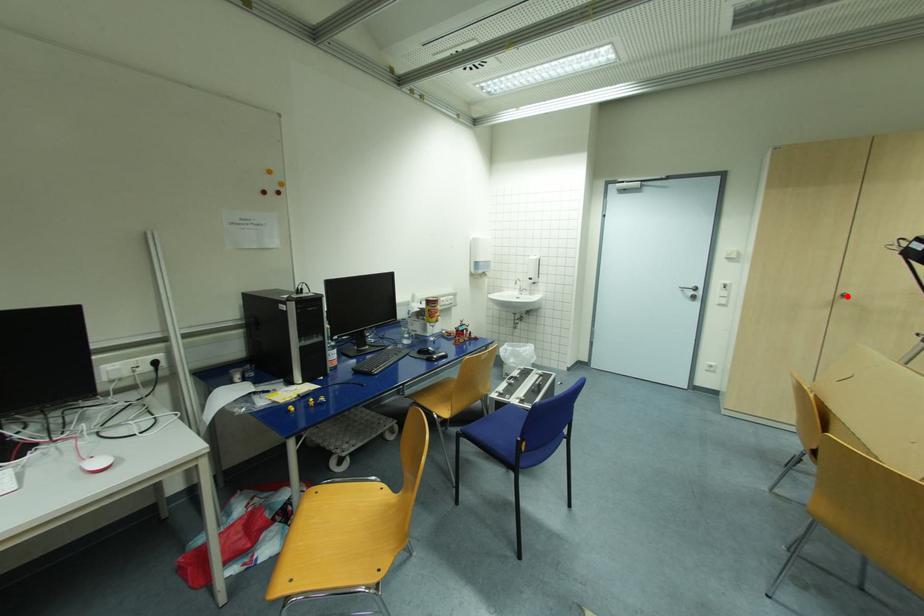
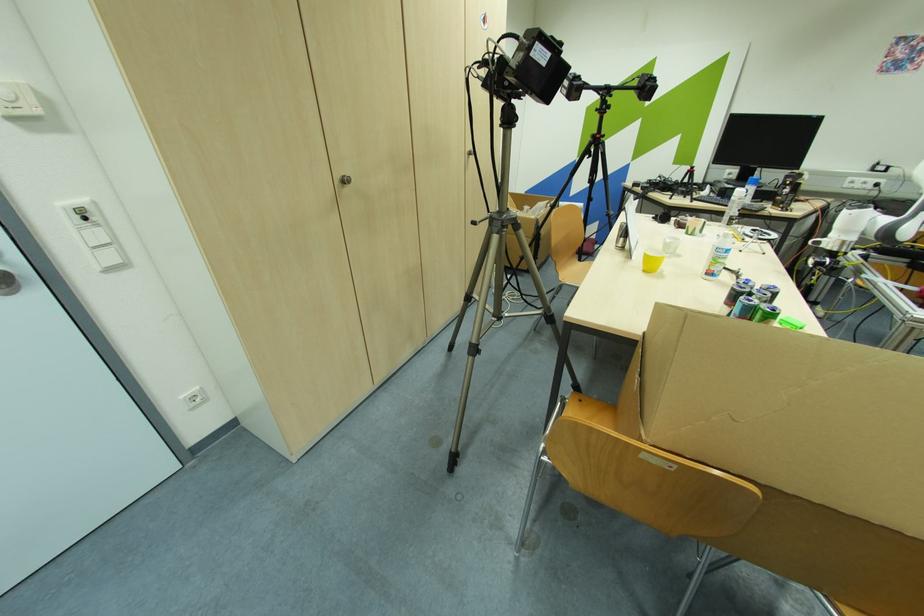
The point at the highlighted location is marked in the first image. Where is the corresponding point in the second image?

(348, 182)